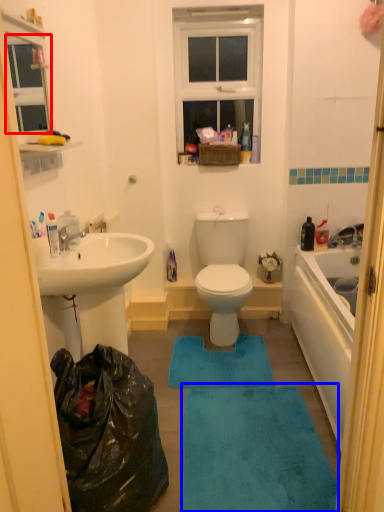
Question: Which point is further to the camera, window screen (highlighted by a red box) or bath mat (highlighted by a blue box)?

Choices:
 (A) window screen
 (B) bath mat

Answer: (B)